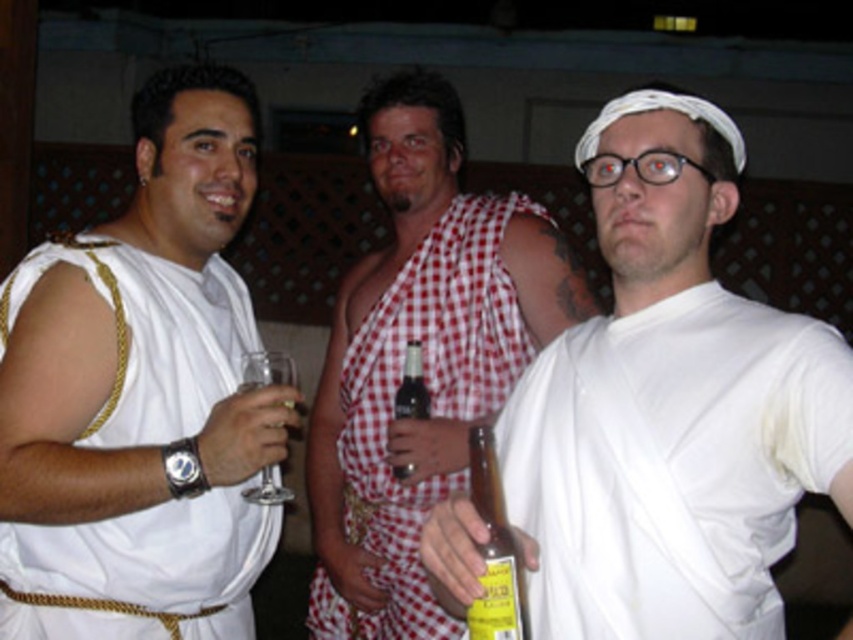
Between white fabric toga at left and red checkered cloth at center, which one has less height?

Standing shorter between the two is white fabric toga at left.

Where is `white fabric toga at left`? This screenshot has width=853, height=640. white fabric toga at left is located at coordinates (141, 394).

You are a GUI agent. You are given a task and a screenshot of the screen. Output one action in this format:
    pyautogui.click(x=<x>, y=<y>)
    Task: Click on the white fabric toga at left
    This screenshot has height=640, width=853.
    Given the screenshot: What is the action you would take?
    (141, 394)

Is yellow glass bottle at center bigger than brown glass bottle at center?

Yes.

This screenshot has width=853, height=640. What are the coordinates of `yellow glass bottle at center` in the screenshot? It's located at click(x=494, y=548).

Image resolution: width=853 pixels, height=640 pixels. What do you see at coordinates (670, 406) in the screenshot?
I see `white cloth toga at center` at bounding box center [670, 406].

Is point (621, 602) in front of point (36, 369)?

Yes.

You are a GUI agent. You are given a task and a screenshot of the screen. Output one action in this format:
    pyautogui.click(x=<x>, y=<y>)
    Task: Click on the white cloth toga at center
    Image resolution: width=853 pixels, height=640 pixels.
    Given the screenshot: What is the action you would take?
    pyautogui.click(x=670, y=406)